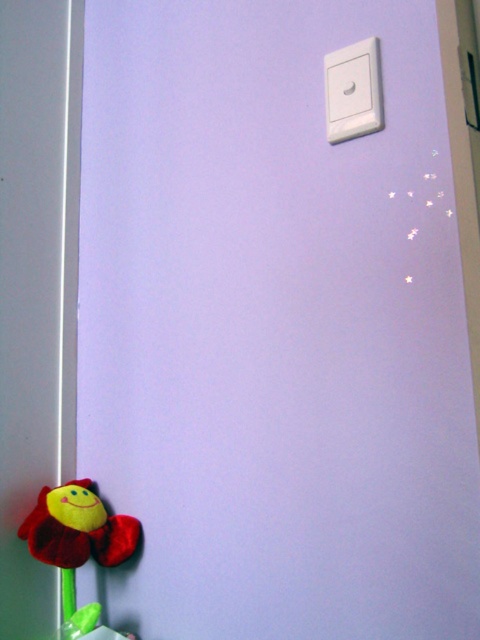
Question: Does velvety red flower at bottom left appear on the left side of white plastic light switch at upper right?

Choices:
 (A) no
 (B) yes

Answer: (B)

Question: Is velvety red flower at bottom left positioned in front of white plastic light switch at upper right?

Choices:
 (A) no
 (B) yes

Answer: (A)

Question: Which of the following is the closest to the observer?

Choices:
 (A) (347, 93)
 (B) (60, 536)

Answer: (A)

Question: Which point is farther from the camera taking this photo?

Choices:
 (A) (x=367, y=108)
 (B) (x=85, y=547)

Answer: (B)

Question: Can you confirm if velvety red flower at bottom left is positioned above white plastic light switch at upper right?

Choices:
 (A) yes
 (B) no

Answer: (B)